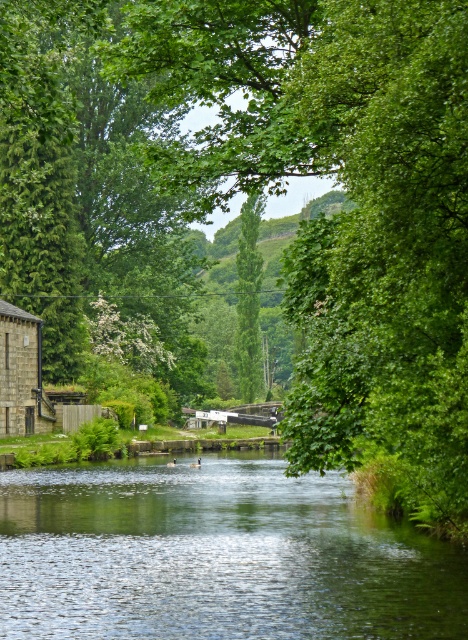
Question: Among these points, which one is farthest from the camera?

Choices:
 (A) (329, 630)
 (B) (241, 211)

Answer: (B)

Question: Which object is farther from the camera taking this photo?

Choices:
 (A) green glossy water at center
 (B) green leafy tree at center

Answer: (B)

Question: Can you confirm if green glossy water at center is wider than green leafy tree at center?

Choices:
 (A) yes
 (B) no

Answer: (A)

Question: Does green glossy water at center appear under stone brick hut at left?

Choices:
 (A) no
 (B) yes

Answer: (B)

Question: Which of the following is the farthest from the observer?

Choices:
 (A) (97, 576)
 (B) (15, 424)
 (C) (245, 264)

Answer: (C)

Question: Is green glossy water at center below green leafy tree at center?

Choices:
 (A) no
 (B) yes

Answer: (B)